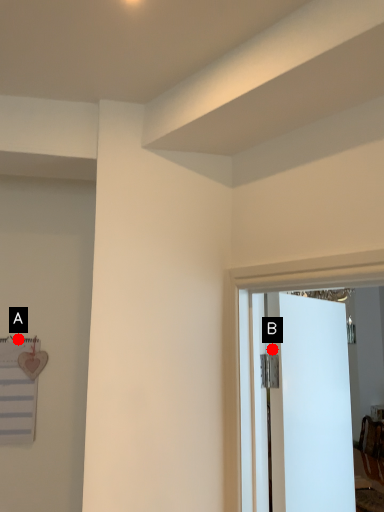
Question: Two points are circled on the image, labeled by A and B beside each circle. Which of the following is the farthest from the observer?

Choices:
 (A) A is further
 (B) B is further

Answer: (A)